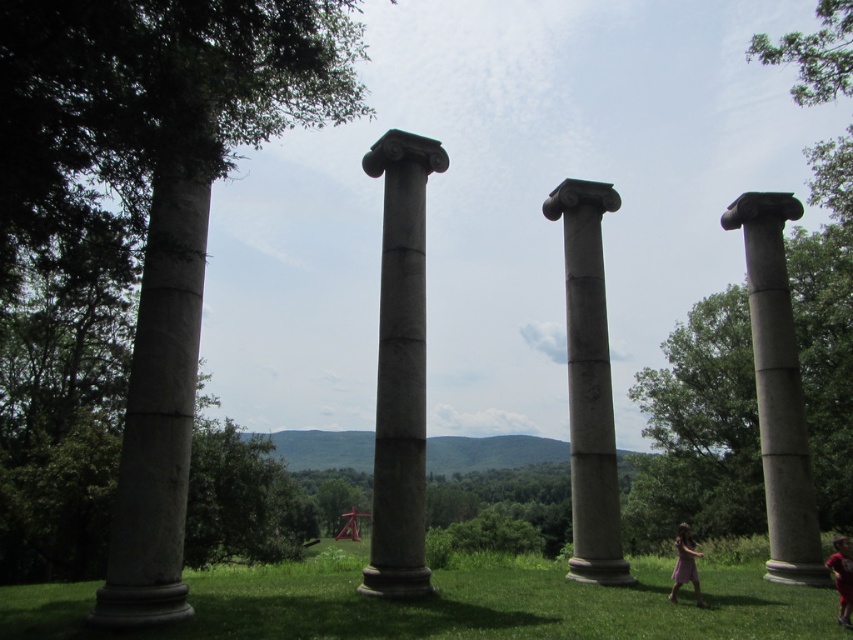
You are standing at the base of the columns in the foreground of the image. You see the green grass at lower center and the purple cotton dress at lower right. Which object is wider from your perspective?

The green grass at lower center might be wider than the purple cotton dress at lower right.

You are standing in front of the columns and want to take a photo of the two points marked in the scene. Which point, point (x=618, y=531) or point (x=685, y=536), is closer to your camera?

Point (x=618, y=531) is further to the camera than point (x=685, y=536), so the closer point to your camera is point (x=685, y=536).